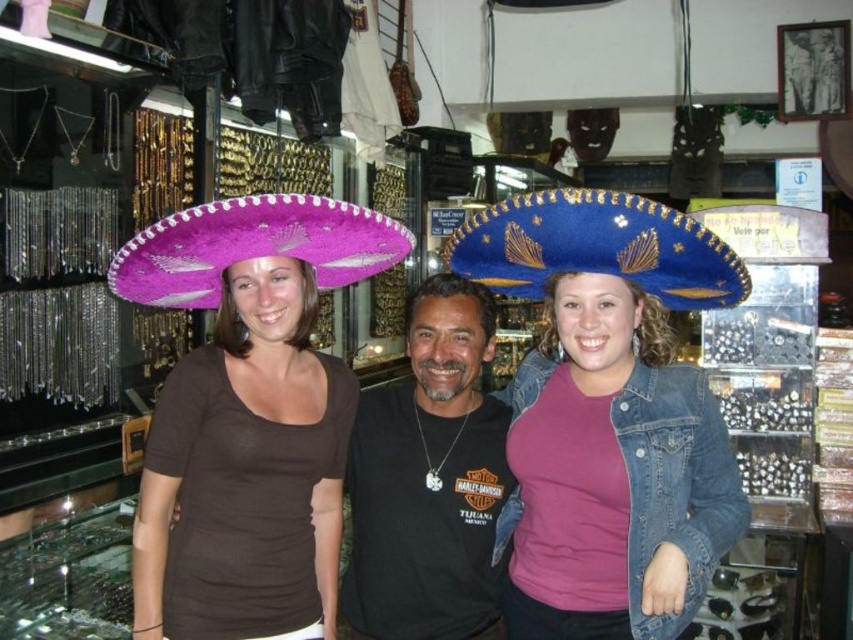
Question: Can you confirm if black cotton t-shirt at center is positioned to the left of pink felt sombrero at left?

Choices:
 (A) no
 (B) yes

Answer: (A)

Question: Does matte pink fabric sombrero at upper left appear on the left side of blue felt sombrero at center?

Choices:
 (A) no
 (B) yes

Answer: (B)

Question: Estimate the real-world distances between objects in this image. Which object is farther from the blue denim jacket at center?

Choices:
 (A) black cotton t-shirt at center
 (B) pink felt sombrero at left
 (C) matte pink fabric sombrero at upper left

Answer: (B)

Question: Is black cotton t-shirt at center to the right of blue felt sombrero at center from the viewer's perspective?

Choices:
 (A) no
 (B) yes

Answer: (A)

Question: Considering the real-world distances, which object is closest to the blue denim jacket at center?

Choices:
 (A) black cotton t-shirt at center
 (B) blue felt sombrero at center
 (C) matte pink fabric sombrero at upper left

Answer: (A)

Question: Which of the following is the farthest from the observer?

Choices:
 (A) (589, 563)
 (B) (650, 224)

Answer: (A)